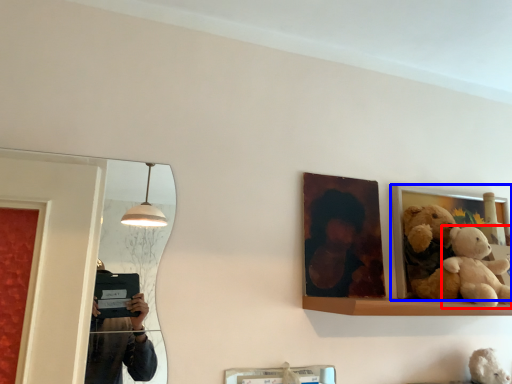
Question: Which object appears farthest to the camera in this image, teddy bear (highlighted by a red box) or picture frame (highlighted by a blue box)?

Choices:
 (A) teddy bear
 (B) picture frame

Answer: (B)